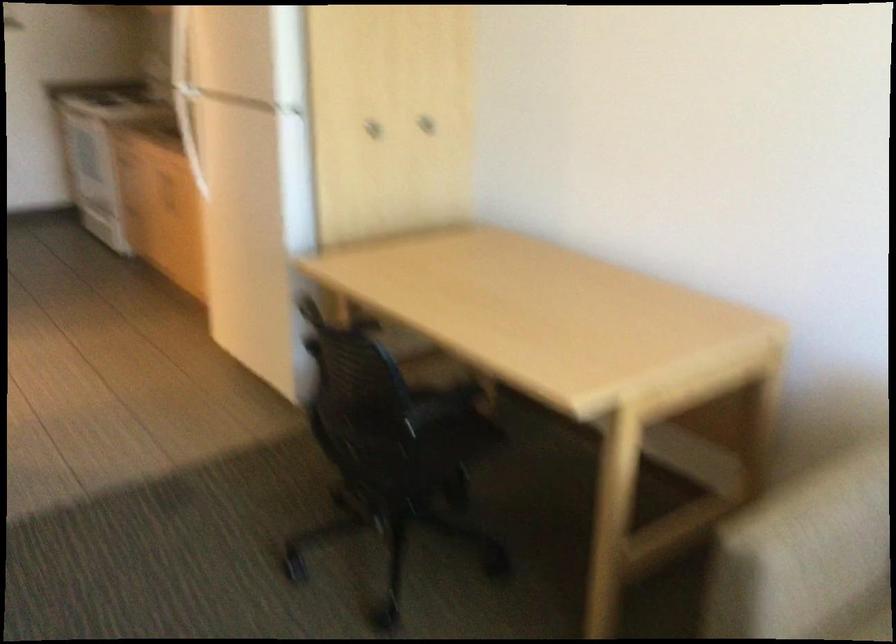
I want to click on chair sitting surface, so click(x=440, y=404).